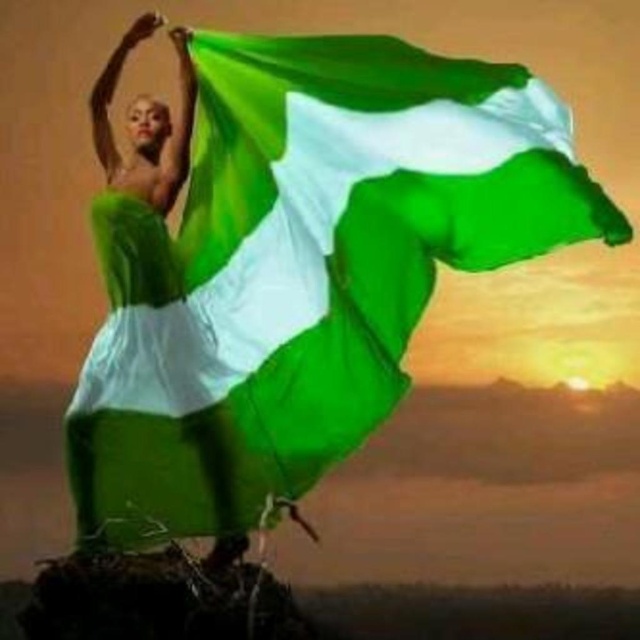
Which of these two, green fabric flag at center or matte green fabric at center, stands shorter?

Standing shorter between the two is green fabric flag at center.

Which is behind, point (342, 273) or point (132, 243)?

Positioned behind is point (132, 243).

Is point (353, 269) positioned after point (92, 132)?

No, it is not.

The width and height of the screenshot is (640, 640). In order to click on green fabric flag at center in this screenshot , I will do `click(298, 264)`.